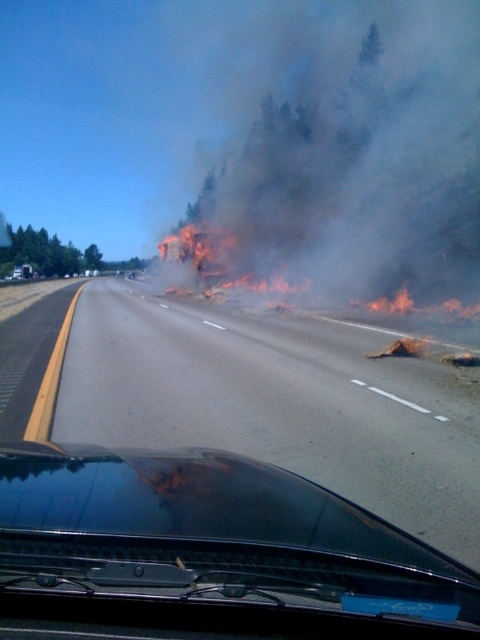
Question: Is black smoke at upper center to the right of transparent glass windshield at center from the viewer's perspective?

Choices:
 (A) no
 (B) yes

Answer: (B)

Question: Which point is farther from the camera taking this photo?

Choices:
 (A) (181, 476)
 (B) (384, 388)

Answer: (B)

Question: Among these points, which one is nearest to the camera?

Choices:
 (A) (120, 502)
 (B) (315, 252)

Answer: (A)

Question: Which point is closer to the camera taking this photo?

Choices:
 (A) (241, 476)
 (B) (313, 211)
 (C) (470, 458)

Answer: (A)

Question: Does black smoke at upper center appear on the left side of transparent glass windshield at center?

Choices:
 (A) no
 (B) yes

Answer: (A)

Question: Does asphalt road at center come in front of black smoke at upper center?

Choices:
 (A) no
 (B) yes

Answer: (B)